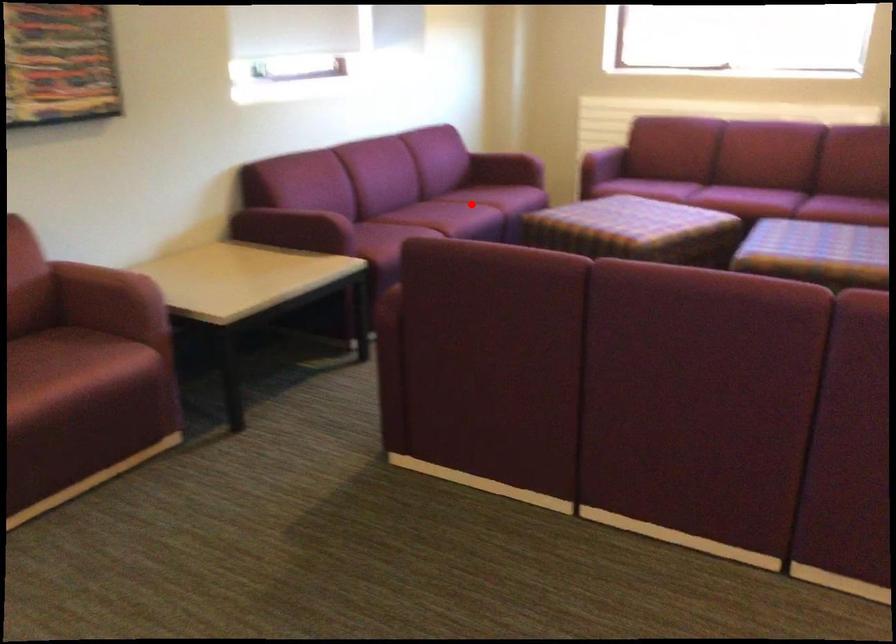
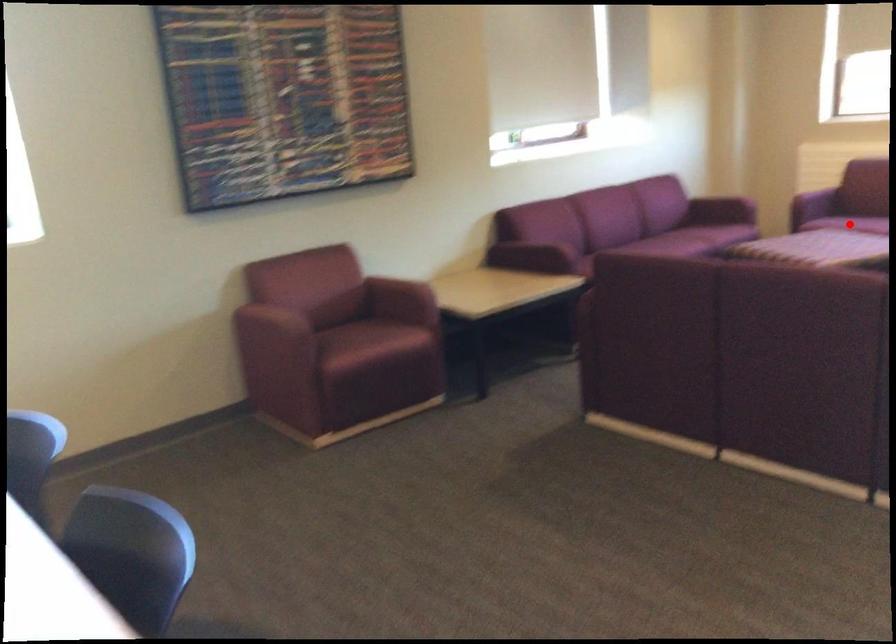
I am providing you with two images of the same scene from different viewpoints. A red point is marked on the first image and another point is marked on the second image. Are the points marked in image1 and image2 representing the same 3D position?

No